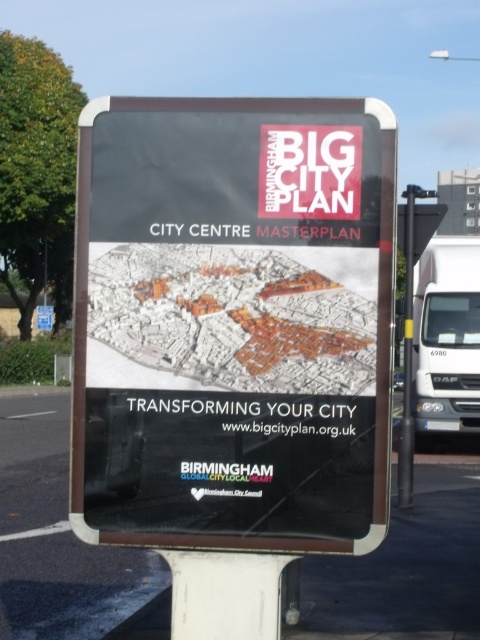
Consider the image. Who is taller, matte black sign at center or blue plastic street sign at upper left?

matte black sign at center

Between matte black sign at center and blue plastic street sign at upper left, which one appears on the left side from the viewer's perspective?

blue plastic street sign at upper left is more to the left.

Does point (245, 246) come behind point (41, 328)?

No, it is not.

The height and width of the screenshot is (640, 480). I want to click on matte black sign at center, so click(232, 323).

Is point (408, 387) more distant than point (49, 324)?

No, (408, 387) is closer to viewer.

Consider the image. Is white plastic pole at right closer to camera compared to blue plastic street sign at upper left?

That is True.

Who is more forward, (409, 195) or (37, 326)?

Point (409, 195) is more forward.

This screenshot has height=640, width=480. I want to click on white plastic pole at right, so click(407, 346).

Between matte black sign at center and metallic pole at right, which one has less height?

matte black sign at center is shorter.

Consider the image. Does matte black sign at center have a larger size compared to metallic pole at right?

Actually, matte black sign at center might be smaller than metallic pole at right.

In order to click on matte black sign at center in this screenshot , I will do `click(232, 323)`.

The image size is (480, 640). Identify the location of matte black sign at center. [232, 323].